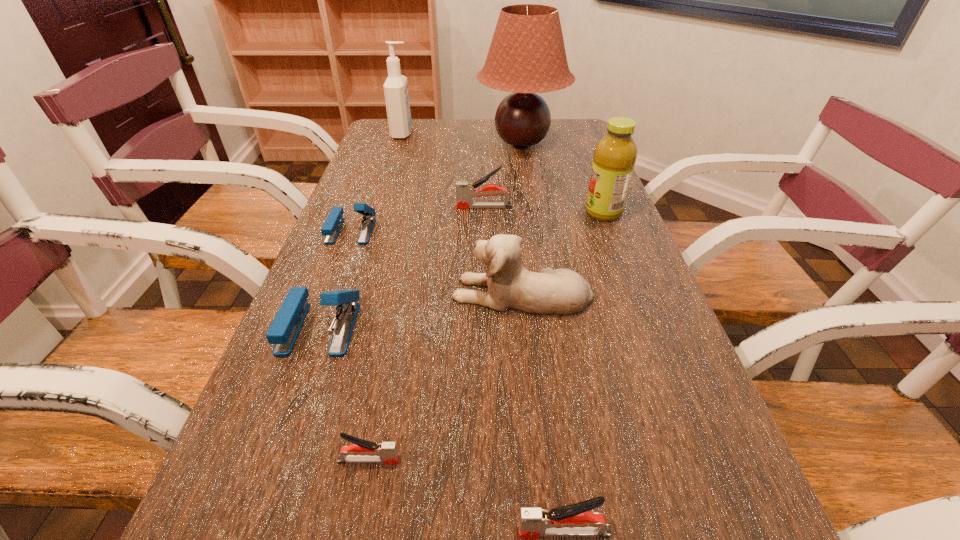
Find the location of `vacant region located on the front-facing side of the sixth shortest object`. vacant region located on the front-facing side of the sixth shortest object is located at coordinates (423, 293).

Identify the location of vacant region located 0.090m on the front-facing side of the sixth shortest object. (410, 293).

Identify the location of vacant space located on the handle side of the farthest stapler. (395, 207).

Find the location of a particular element. Image resolution: width=960 pixels, height=540 pixels. vacant area situated 0.180m on the handle side of the farthest stapler is located at coordinates (391, 207).

You are a GUI agent. You are given a task and a screenshot of the screen. Output one action in this format:
    pyautogui.click(x=<x>, y=<y>)
    Task: Click on the vacant space located on the handle side of the farthest stapler
    
    Given the screenshot: What is the action you would take?
    pyautogui.click(x=383, y=207)

I want to click on free space located 0.130m on the front of the third farthest stapler, so click(x=285, y=421).

Image resolution: width=960 pixels, height=540 pixels. What are the coordinates of `vacant region located on the back of the second farthest stapler` in the screenshot? It's located at (372, 179).

Locate an element on the screen. The width and height of the screenshot is (960, 540). free space located 0.250m on the handle side of the second nearest object is located at coordinates (564, 460).

The height and width of the screenshot is (540, 960). What are the coordinates of `lampshade that is at the far edge` in the screenshot? It's located at (527, 55).

Where is `cleansing agent located at the far edge`? The image size is (960, 540). cleansing agent located at the far edge is located at coordinates (396, 93).